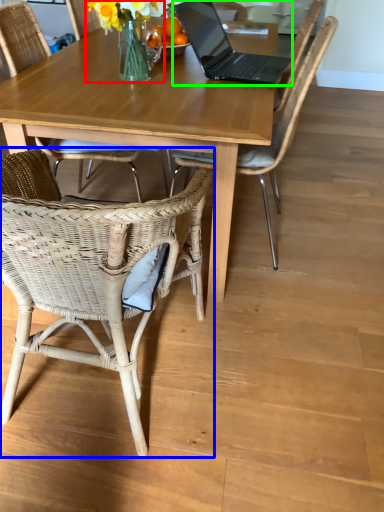
Question: Considering the real-world distances, which object is closest to floral arrangement (highlighted by a red box)? chair (highlighted by a blue box) or laptop (highlighted by a green box).

Choices:
 (A) chair
 (B) laptop

Answer: (B)